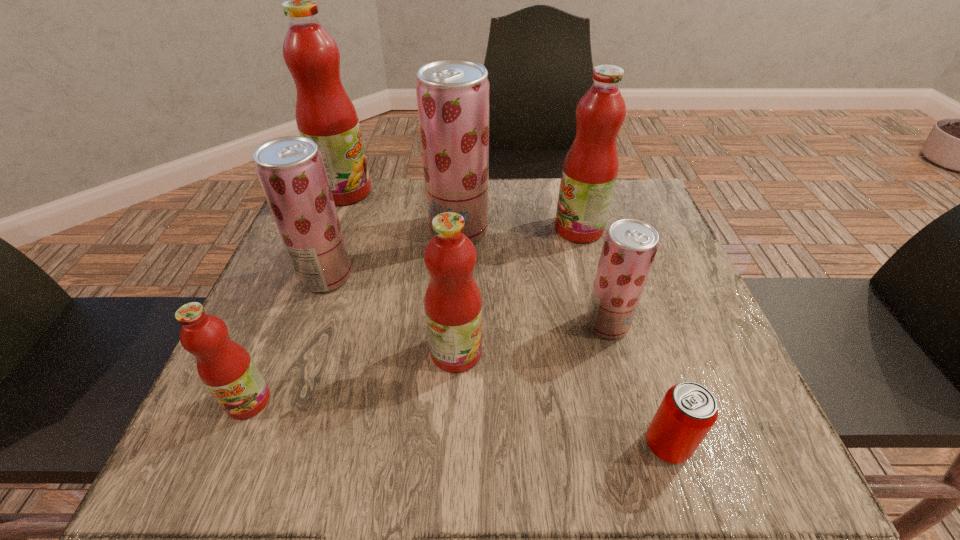
You are a GUI agent. You are given a task and a screenshot of the screen. Output one action in this format:
    pyautogui.click(x=<x>, y=<y>)
    Task: Click on the unoccupied position between the can and the tallest object
    This screenshot has height=540, width=960.
    Given the screenshot: What is the action you would take?
    tap(506, 319)

This screenshot has width=960, height=540. I want to click on empty space between the smallest strawberry fruit juice and the second nearest pink fruit juice, so click(x=532, y=338).

Locate an element on the screen. vacant space in between the tallest fruit juice and the shortest object is located at coordinates (506, 319).

Locate an element on the screen. The width and height of the screenshot is (960, 540). vacant space that is in between the second strawberry fruit juice from right to left and the can is located at coordinates (563, 338).

You are a GUI agent. You are given a task and a screenshot of the screen. Output one action in this format:
    pyautogui.click(x=<x>, y=<y>)
    Task: Click on the empty location between the seventh farthest object and the tallest object
    This screenshot has width=960, height=540.
    Given the screenshot: What is the action you would take?
    pyautogui.click(x=297, y=296)

The width and height of the screenshot is (960, 540). I want to click on free space between the nearest strawberry fruit juice and the smallest pink fruit juice, so click(x=428, y=362).

This screenshot has width=960, height=540. I want to click on free space between the second biggest strawberry fruit juice and the second smallest pink fruit juice, so click(391, 314).

Select which object is the sixth closest to the biggest pink fruit juice. Please provide its 2D coordinates. Your answer should be formatted as a tuple, i.e. [(x, y)], where the tuple contains the x and y coordinates of a point satisfying the conditions above.

[(630, 245)]

Select which object is the third closest to the second nearest strawberry fruit juice. Please provide its 2D coordinates. Your answer should be formatted as a tuple, i.e. [(x, y)], where the tuple contains the x and y coordinates of a point satisfying the conditions above.

[(453, 303)]

Point out which fruit juice is positioned as the third nearest to the nearest pink fruit juice. Please provide its 2D coordinates. Your answer should be formatted as a tuple, i.e. [(x, y)], where the tuple contains the x and y coordinates of a point satisfying the conditions above.

[(453, 95)]